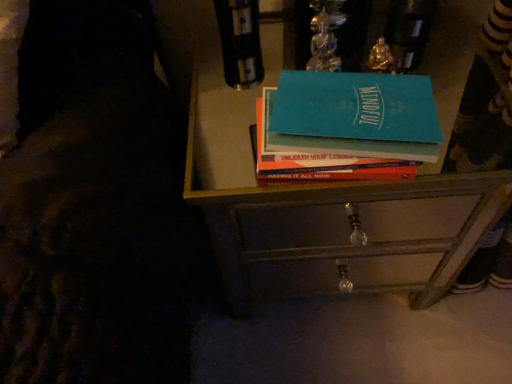
The height and width of the screenshot is (384, 512). What do you see at coordinates (318, 158) in the screenshot? I see `teal matte book at center` at bounding box center [318, 158].

This screenshot has height=384, width=512. What are the coordinates of `metallic drawer at center` in the screenshot? It's located at (340, 274).

The image size is (512, 384). Find the location of `teal matte book at center`. teal matte book at center is located at coordinates (318, 158).

Which is in front, metallic drawer at center or teal matte book at center?

teal matte book at center is closer to the camera.

Considering the sizes of objects metallic drawer at center and teal matte book at center in the image provided, who is smaller, metallic drawer at center or teal matte book at center?

Smaller between the two is teal matte book at center.

From the image's perspective, which object appears higher, metallic drawer at center or teal matte book at center?

teal matte book at center, from the image's perspective.

From a real-world perspective, who is located higher, metallic drawer at center or teal matte book at center?

teal matte book at center, from a real-world perspective.

Where is `the chest of drawers below the teal matte book at center (from the image's perspective)`? the chest of drawers below the teal matte book at center (from the image's perspective) is located at coordinates (336, 191).

How much distance is there between teal matte book at center and metallic drawer at center?

teal matte book at center and metallic drawer at center are 36.08 centimeters apart.

Considering the relative positions of teal matte book at center and metallic drawer at center in the image provided, is teal matte book at center to the left or to the right of metallic drawer at center?

Clearly, teal matte book at center is on the left of metallic drawer at center in the image.

Consider the image. Is teal matte book at center not inside metallic drawer at center?

That's correct, teal matte book at center is outside of metallic drawer at center.

Consider the image. Is metallic drawer at center facing away from teal matte book at center?

metallic drawer at center is not turned away from teal matte book at center.

Is metallic drawer at center far away from teal matte book at center?

No.

Considering the positions of objects metallic drawer at center and teal matte book at center in the image provided, who is in front, metallic drawer at center or teal matte book at center?

teal matte book at center is closer to the camera.

From a real-world perspective, is metallic drawer at center positioned above or below metallic drawer at center?

metallic drawer at center is situated higher than metallic drawer at center in the real world.

Which of these two, metallic drawer at center or metallic drawer at center, stands taller?

Standing taller between the two is metallic drawer at center.

Based on their sizes in the image, would you say metallic drawer at center is bigger or smaller than metallic drawer at center?

In the image, metallic drawer at center appears to be larger than metallic drawer at center.

Which is behind, point (268, 273) or point (414, 278)?

Positioned behind is point (414, 278).

How distant is teal matte book at center from metallic drawer at center?

A distance of 41.59 centimeters exists between teal matte book at center and metallic drawer at center.

Find the location of a particular element. The image size is (512, 384). book in front of the metallic drawer at center is located at coordinates (318, 158).

From the image's perspective, who appears lower, teal matte book at center or metallic drawer at center?

metallic drawer at center is shown below in the image.

Between teal matte book at center and metallic drawer at center, which one has smaller width?

Thinner between the two is metallic drawer at center.

Is metallic drawer at center bigger or smaller than metallic drawer at center?

In the image, metallic drawer at center appears to be smaller than metallic drawer at center.

Is point (355, 267) closer or farther from the camera than point (201, 172)?

Clearly, point (355, 267) is closer to the camera than point (201, 172).

From a real-world perspective, between metallic drawer at center and metallic drawer at center, who is vertically higher?

metallic drawer at center.

In order to click on drawer below the metallic drawer at center (from the image's perspective) in this screenshot , I will do `click(340, 274)`.

What are the coordinates of `book that is in front of the metallic drawer at center` in the screenshot? It's located at (318, 158).

Image resolution: width=512 pixels, height=384 pixels. I want to click on the chest of drawers beneath the teal matte book at center (from a real-world perspective), so click(x=336, y=191).

When comparing their distances from metallic drawer at center, does teal matte book at center or metallic drawer at center seem further?

teal matte book at center.

Considering their positions, is metallic drawer at center positioned closer to teal matte book at center than metallic drawer at center?

metallic drawer at center is positioned closer to the anchor teal matte book at center.

Estimate the real-world distances between objects in this image. Which object is further from metallic drawer at center, metallic drawer at center or teal matte book at center?

The object further to metallic drawer at center is teal matte book at center.

Consider the image. Estimate the real-world distances between objects in this image. Which object is closer to metallic drawer at center, metallic drawer at center or teal matte book at center?

Among the two, metallic drawer at center is located nearer to metallic drawer at center.

Estimate the real-world distances between objects in this image. Which object is closer to teal matte book at center, metallic drawer at center or metallic drawer at center?

metallic drawer at center.

Which object lies nearer to the anchor point metallic drawer at center, teal matte book at center or metallic drawer at center?

metallic drawer at center is closer to metallic drawer at center.

Where is `chest of drawers between teal matte book at center and metallic drawer at center from front to back`? chest of drawers between teal matte book at center and metallic drawer at center from front to back is located at coordinates (336, 191).